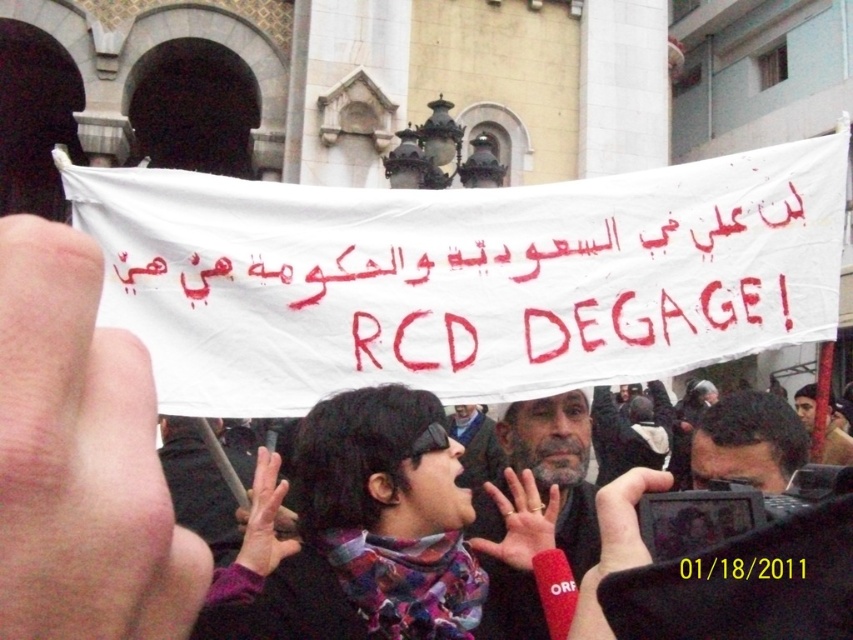
Question: Does gray matte helmet at center have a larger size compared to dark hair at center?

Choices:
 (A) yes
 (B) no

Answer: (B)

Question: Which of the following is the closest to the observer?

Choices:
 (A) black paper at center
 (B) dark hair at center
 (C) gray matte helmet at center
 (D) dark brown leather jacket at center

Answer: (A)

Question: Is black paper at center to the left of dark brown leather jacket at center from the viewer's perspective?

Choices:
 (A) yes
 (B) no

Answer: (A)

Question: Considering the real-world distances, which object is farthest from the dark hair at center?

Choices:
 (A) gray hair man at center
 (B) gray matte helmet at center
 (C) dark brown leather jacket at center
 (D) black paper at center

Answer: (D)

Question: Where is dark hair at center located in relation to gray hair man at center in the image?

Choices:
 (A) above
 (B) below

Answer: (A)

Question: Which of these objects is positioned closest to the gray matte helmet at center?

Choices:
 (A) dark hair at center
 (B) dark brown leather jacket at center
 (C) gray hair man at center
 (D) black paper at center

Answer: (C)